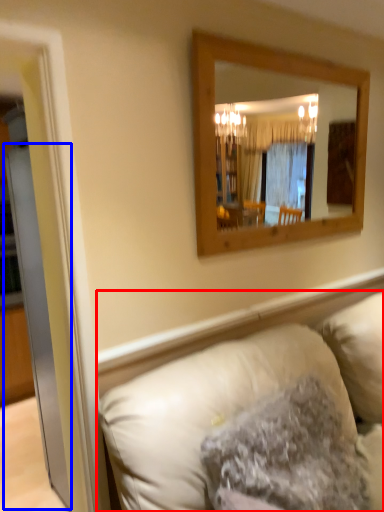
Question: Which object appears farthest to the camera in this image, studio couch (highlighted by a red box) or glass door (highlighted by a blue box)?

Choices:
 (A) studio couch
 (B) glass door

Answer: (B)